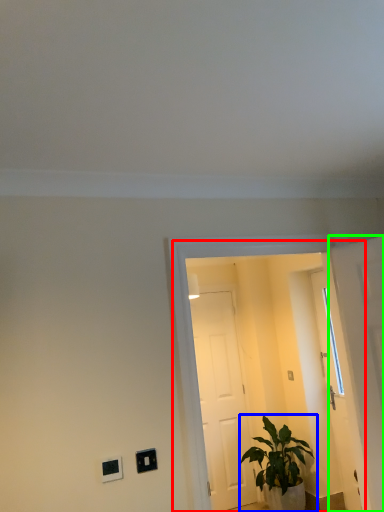
Question: Based on their relative distances, which object is nearer to glass door (highlighted by a red box)? Choose from houseplant (highlighted by a blue box) and door (highlighted by a green box).

Choices:
 (A) houseplant
 (B) door

Answer: (A)